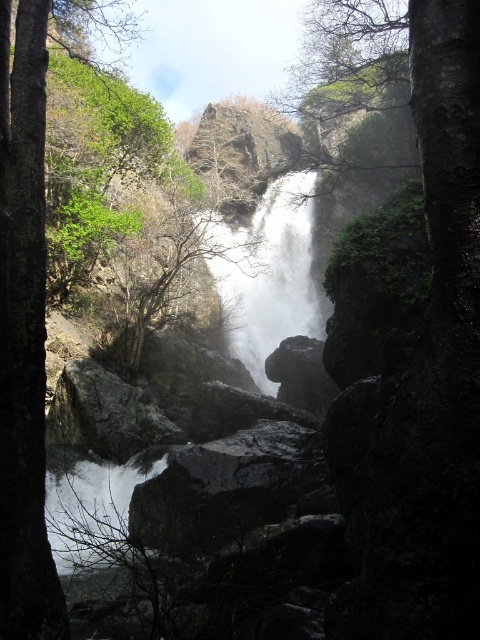
You are standing at the edge of the pool below the waterfall. You see the dark gray rock at center and the white smooth waterfall at center. Which object is closer to you?

The dark gray rock at center is closer to you because it is below the white smooth waterfall at center, meaning it is positioned nearer to your current location at the pool edge.

From the picture: You are a hiker trying to cross the waterfall area. You notice two rocks in the center of the scene, the dark gray rock at center and the rough textured rock at center. Which rock should you step on first if you want to reach the other side safely?

You should step on the rough textured rock at center first because it occupies more space than the dark gray rock at center, providing a larger and more stable surface for safe footing.

In the scene shown: You are standing at the edge of the waterfall and want to reach the dark gray rock at center. Considering your height is 1.7 meters, can you safely step onto it without falling into the water?

The dark gray rock at center is 9.37 meters away from the viewer. Since the distance is quite large, stepping onto it might be dangerous as it requires a significant jump. It is recommended to find a safer path or use appropriate equipment.